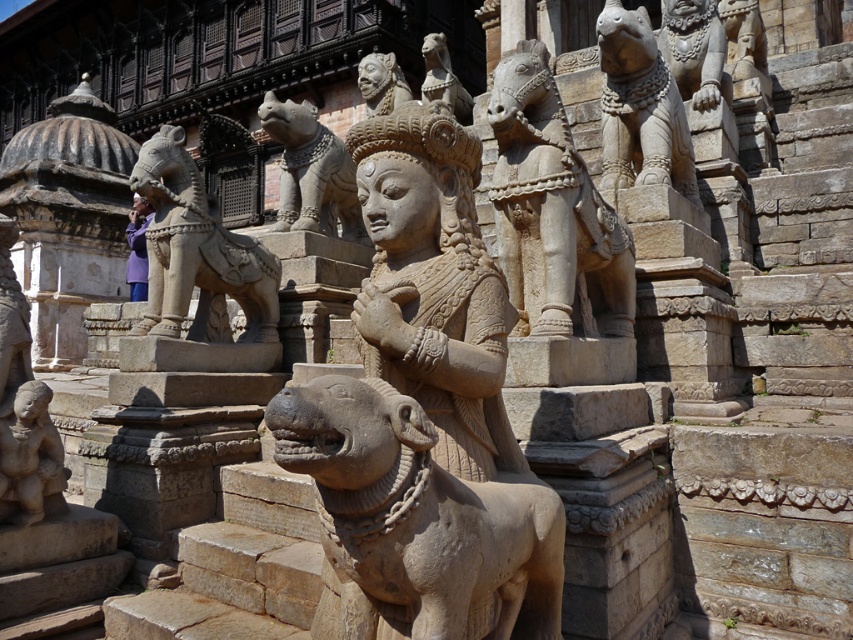
You are an art conservator assessing the statues for preservation. You need to determine if the stone lion at upper right can fit through a narrow doorway that the polished stone lion at upper center previously passed through. Based on their widths, what would you conclude?

The stone lion at upper right might be wider than the polished stone lion at upper center, so there is a possibility that it cannot fit through the doorway the polished stone lion at upper center previously passed through.

You are standing at the base of the temple steps and want to locate the carved stone horse at upper center. According to the coordinates provided, what is its exact position on the image?

The carved stone horse at upper center is located at the 2D coordinates of point (550, 209).